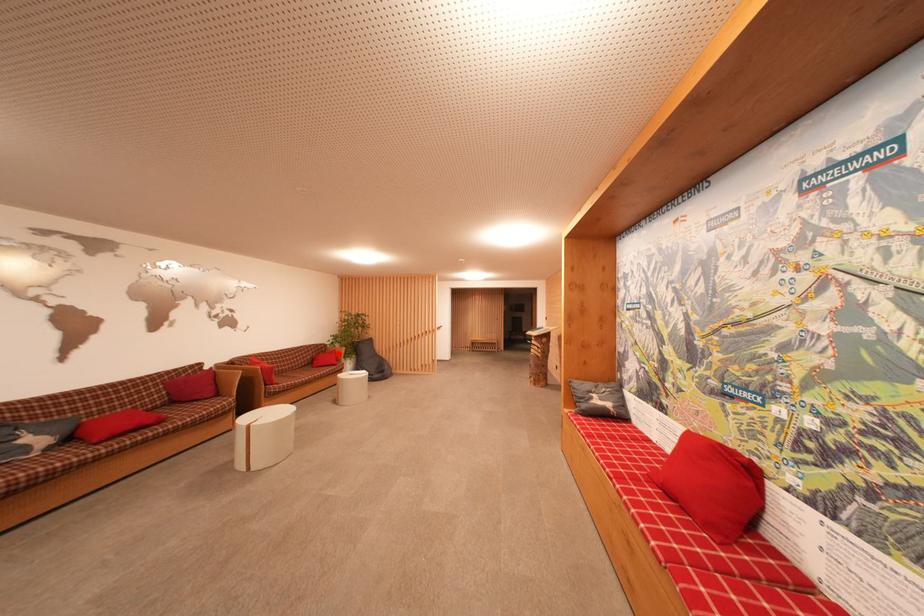
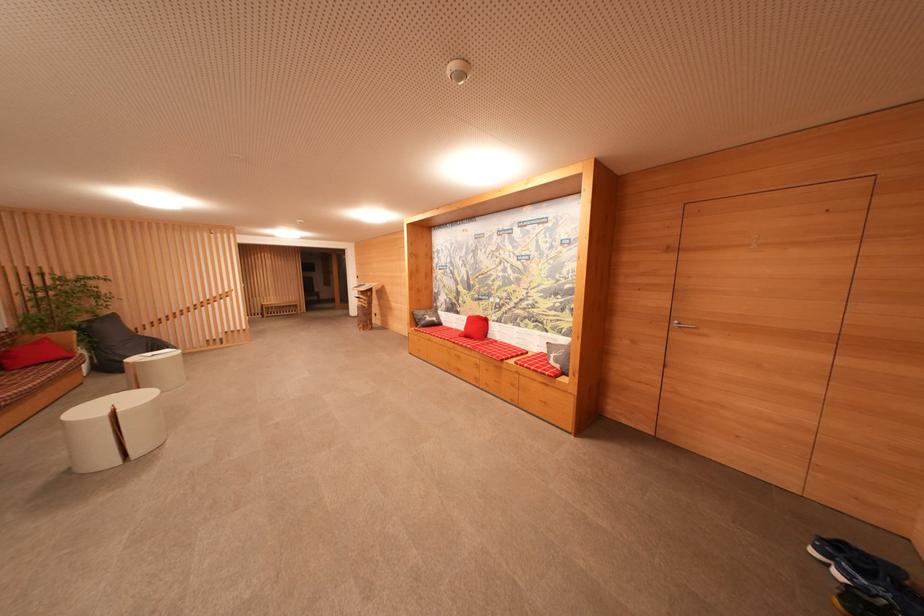
Locate, in the second image, the point that corresponds to the highlighted location in the first image.

(50, 342)